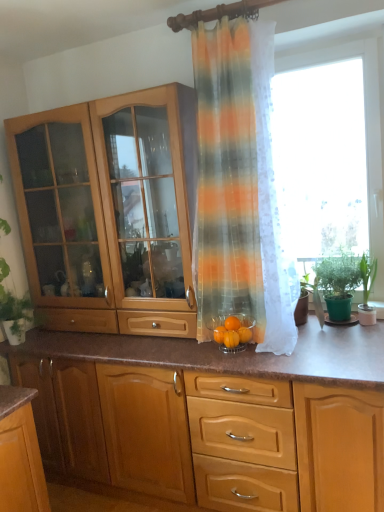
Measure the distance between transparent fabric at right and camera.

They are 6.72 feet apart.

In order to face wooden cabinet at center, which is the 2th cabinetry from top to bottom, should I rotate leftwards or rightwards?

To face it directly, rotate right by 0.000 degrees.

Identify the location of translucent striped curtain at center. (239, 187).

Describe the element at coordinates (244, 334) in the screenshot. I see `orange matte glass bowl at center, the second orange viewed from the left` at that location.

I want to click on orange matte glass bowl at center, the first orange from the right, so click(244, 334).

This screenshot has height=512, width=384. What do you see at coordinates (232, 323) in the screenshot?
I see `orange matte glass bowl at center, the second orange from the right` at bounding box center [232, 323].

You are a GUI agent. You are given a task and a screenshot of the screen. Output one action in this format:
    pyautogui.click(x=<x>, y=<y>)
    Task: Click on the transparent fabric at right
    This screenshot has height=512, width=384.
    Given the screenshot: What is the action you would take?
    pyautogui.click(x=365, y=118)

Which is more to the right, wooden cabinet at center, which is the 2th cabinetry from top to bottom, or orange matte glass bowl at center, the second orange from the right?

From the viewer's perspective, orange matte glass bowl at center, the second orange from the right, appears more on the right side.

Considering the relative positions of wooden cabinet at center, which is the 2th cabinetry from top to bottom, and orange matte glass bowl at center, the second orange from the right, in the image provided, is wooden cabinet at center, which is the 2th cabinetry from top to bottom, in front of orange matte glass bowl at center, the second orange from the right,?

Yes, the depth of wooden cabinet at center, which is the 2th cabinetry from top to bottom, is less than that of orange matte glass bowl at center, the second orange from the right.

From the image's perspective, which one is positioned higher, wooden cabinet at center, which is the 2th cabinetry from top to bottom, or orange matte glass bowl at center, the second orange from the right?

From the image's view, orange matte glass bowl at center, the second orange from the right, is above.

Is wooden cabinet at center, which is the 2th cabinetry from top to bottom, not within orange matte glass bowl at center, the second orange from the right?

wooden cabinet at center, which is the 2th cabinetry from top to bottom, is positioned outside orange matte glass bowl at center, the second orange from the right.

Does point (364, 285) come in front of point (239, 323)?

That is False.

Who is smaller, green leafy plant at right, the 1th houseplant in the right-to-left sequence, or orange matte glass bowl at center, the second orange from the right?

With smaller size is orange matte glass bowl at center, the second orange from the right.

How much distance is there between green leafy plant at right, the 1th houseplant in the right-to-left sequence, and orange matte glass bowl at center, the second orange from the right?

green leafy plant at right, the 1th houseplant in the right-to-left sequence, is 27.29 inches from orange matte glass bowl at center, the second orange from the right.

Considering the sizes of objects light brown wood cabinet at left, the second cabinetry positioned from the bottom, and wooden cabinet at center, which is the 2th cabinetry from top to bottom, in the image provided, who is taller, light brown wood cabinet at left, the second cabinetry positioned from the bottom, or wooden cabinet at center, which is the 2th cabinetry from top to bottom,?

With more height is light brown wood cabinet at left, the second cabinetry positioned from the bottom.

Is light brown wood cabinet at left, marked as the 1th cabinetry in a top-to-bottom arrangement, located outside wooden cabinet at center, the 1th cabinetry in the bottom-to-top sequence?

That's correct, light brown wood cabinet at left, marked as the 1th cabinetry in a top-to-bottom arrangement, is outside of wooden cabinet at center, the 1th cabinetry in the bottom-to-top sequence.

Is light brown wood cabinet at left, marked as the 1th cabinetry in a top-to-bottom arrangement, looking in the opposite direction of wooden cabinet at center, the 1th cabinetry in the bottom-to-top sequence?

No.

Which of these two, light brown wood cabinet at left, marked as the 1th cabinetry in a top-to-bottom arrangement, or wooden cabinet at center, the 1th cabinetry in the bottom-to-top sequence, is wider?

wooden cabinet at center, the 1th cabinetry in the bottom-to-top sequence.

Which of these two, light brown wood cabinet at left, marked as the 1th cabinetry in a top-to-bottom arrangement, or translucent striped curtain at center, stands shorter?

With less height is light brown wood cabinet at left, marked as the 1th cabinetry in a top-to-bottom arrangement.

Is light brown wood cabinet at left, the second cabinetry positioned from the bottom, inside or outside of translucent striped curtain at center?

light brown wood cabinet at left, the second cabinetry positioned from the bottom, is outside translucent striped curtain at center.

Is light brown wood cabinet at left, marked as the 1th cabinetry in a top-to-bottom arrangement, positioned far away from translucent striped curtain at center?

light brown wood cabinet at left, marked as the 1th cabinetry in a top-to-bottom arrangement, is actually quite close to translucent striped curtain at center.

Starting from the translucent striped curtain at center, which cabinetry is the 2nd one to the left? Please provide its 2D coordinates.

[(108, 213)]

Based on the photo, is green matte plant at right, which is the 2th houseplant from right to left, located outside translucent striped curtain at center?

Yes.

Consider the image. From the image's perspective, between green matte plant at right, which is counted as the first houseplant, starting from the left, and translucent striped curtain at center, who is located below?

green matte plant at right, which is counted as the first houseplant, starting from the left, is shown below in the image.

How many degrees apart are the facing directions of green matte plant at right, which is the 2th houseplant from right to left, and translucent striped curtain at center?

The facing directions of green matte plant at right, which is the 2th houseplant from right to left, and translucent striped curtain at center are 0.000755 degrees apart.

In the scene shown: From a real-world perspective, which object rests below the other?

In real-world perspective, green matte plant at right, which is the 2th houseplant from right to left, is lower.

Considering the positions of objects wooden cabinet at center, which is the 2th cabinetry from top to bottom, and orange matte glass bowl at center, the second orange viewed from the left, in the image provided, who is behind, wooden cabinet at center, which is the 2th cabinetry from top to bottom, or orange matte glass bowl at center, the second orange viewed from the left,?

orange matte glass bowl at center, the second orange viewed from the left, is more distant.

From the image's perspective, is wooden cabinet at center, the 1th cabinetry in the bottom-to-top sequence, above orange matte glass bowl at center, the first orange from the right?

No, from the image's perspective, wooden cabinet at center, the 1th cabinetry in the bottom-to-top sequence, is not above orange matte glass bowl at center, the first orange from the right.

How many degrees apart are the facing directions of wooden cabinet at center, the 1th cabinetry in the bottom-to-top sequence, and orange matte glass bowl at center, the first orange from the right?

There is a 3.57-degree angle between the facing directions of wooden cabinet at center, the 1th cabinetry in the bottom-to-top sequence, and orange matte glass bowl at center, the first orange from the right.

From the image's perspective, would you say orange matte glass bowl at center, the first orange positioned from the left, is positioned over wooden cabinet at center, which is the 2th cabinetry from top to bottom?

Yes, from the image's perspective, orange matte glass bowl at center, the first orange positioned from the left, is above wooden cabinet at center, which is the 2th cabinetry from top to bottom.

Is orange matte glass bowl at center, the first orange positioned from the left, inside or outside of wooden cabinet at center, which is the 2th cabinetry from top to bottom?

orange matte glass bowl at center, the first orange positioned from the left, is spatially situated outside wooden cabinet at center, which is the 2th cabinetry from top to bottom.

From the picture: Considering the sizes of objects orange matte glass bowl at center, the first orange positioned from the left, and wooden cabinet at center, which is the 2th cabinetry from top to bottom, in the image provided, who is bigger, orange matte glass bowl at center, the first orange positioned from the left, or wooden cabinet at center, which is the 2th cabinetry from top to bottom,?

wooden cabinet at center, which is the 2th cabinetry from top to bottom.

How far apart are orange matte glass bowl at center, the second orange from the right, and wooden cabinet at center, the 1th cabinetry in the bottom-to-top sequence?

orange matte glass bowl at center, the second orange from the right, and wooden cabinet at center, the 1th cabinetry in the bottom-to-top sequence, are 26.70 inches apart.

The width and height of the screenshot is (384, 512). Identify the location of cabinetry below the orange matte glass bowl at center, the first orange positioned from the left (from the image's perspective). (206, 416).

Starting from the green leafy plant at right, which is the 2th houseplant in left-to-right order, which orange is the 2nd one to the left? Please provide its 2D coordinates.

[(232, 323)]

From the image, which object appears to be nearer to orange matte glass bowl at center, the second orange from the right, green matte plant at right, which is the 2th houseplant from right to left, or wooden cabinet at center, the 1th cabinetry in the bottom-to-top sequence?

green matte plant at right, which is the 2th houseplant from right to left, is positioned closer to the anchor orange matte glass bowl at center, the second orange from the right.

From the picture: Based on their spatial positions, is green leafy plant at right, the 1th houseplant in the right-to-left sequence, or transparent fabric at right further from wooden cabinet at center, the 1th cabinetry in the bottom-to-top sequence?

transparent fabric at right is positioned further to the anchor wooden cabinet at center, the 1th cabinetry in the bottom-to-top sequence.

Considering their positions, is light brown wood cabinet at left, the second cabinetry positioned from the bottom, positioned further to green leafy plant at right, which is the 2th houseplant in left-to-right order, than green matte plant at right, which is the 2th houseplant from right to left?

The object further to green leafy plant at right, which is the 2th houseplant in left-to-right order, is light brown wood cabinet at left, the second cabinetry positioned from the bottom.

In the scene shown: Based on their spatial positions, is orange matte glass bowl at center, the second orange from the right, or orange matte glass bowl at center, the first orange from the right, further from transparent fabric at right?

Among the two, orange matte glass bowl at center, the first orange from the right, is located further to transparent fabric at right.

Estimate the real-world distances between objects in this image. Which object is further from orange matte glass bowl at center, the first orange from the right, green leafy plant at right, the 1th houseplant in the right-to-left sequence, or wooden cabinet at center, which is the 2th cabinetry from top to bottom?

Based on the image, wooden cabinet at center, which is the 2th cabinetry from top to bottom, appears to be further to orange matte glass bowl at center, the first orange from the right.

Looking at the image, which one is located further to orange matte glass bowl at center, the second orange from the right, transparent fabric at right or wooden cabinet at center, which is the 2th cabinetry from top to bottom?

transparent fabric at right is further to orange matte glass bowl at center, the second orange from the right.

Based on the photo, based on their spatial positions, is orange matte glass bowl at center, the second orange from the right, or translucent striped curtain at center further from light brown wood cabinet at left, the second cabinetry positioned from the bottom?

orange matte glass bowl at center, the second orange from the right.

Based on the photo, looking at the image, which one is located further to green leafy plant at right, which is the 2th houseplant in left-to-right order, light brown wood cabinet at left, marked as the 1th cabinetry in a top-to-bottom arrangement, or translucent striped curtain at center?

light brown wood cabinet at left, marked as the 1th cabinetry in a top-to-bottom arrangement, is positioned further to the anchor green leafy plant at right, which is the 2th houseplant in left-to-right order.

Identify the location of orange between orange matte glass bowl at center, the second orange from the right, and green leafy plant at right, which is the 2th houseplant in left-to-right order. Image resolution: width=384 pixels, height=512 pixels. (244, 334).

Find the location of a particular element. The width and height of the screenshot is (384, 512). curtain between transparent fabric at right and orange matte glass bowl at center, the second orange viewed from the left, from top to bottom is located at coordinates (239, 187).

Where is `curtain located between orange matte glass bowl at center, the first orange positioned from the left, and green leafy plant at right, which is the 2th houseplant in left-to-right order, in the left-right direction`? curtain located between orange matte glass bowl at center, the first orange positioned from the left, and green leafy plant at right, which is the 2th houseplant in left-to-right order, in the left-right direction is located at coordinates (239, 187).

The width and height of the screenshot is (384, 512). What are the coordinates of `houseplant between wooden cabinet at center, the 1th cabinetry in the bottom-to-top sequence, and green leafy plant at right, the 1th houseplant in the right-to-left sequence` in the screenshot? It's located at (x=338, y=284).